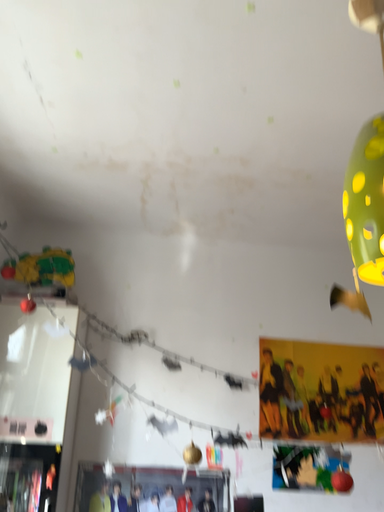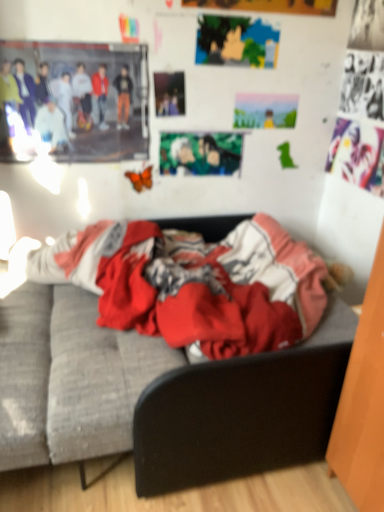
Question: Which way did the camera rotate in the video?

Choices:
 (A) rotated downward
 (B) rotated upward

Answer: (A)